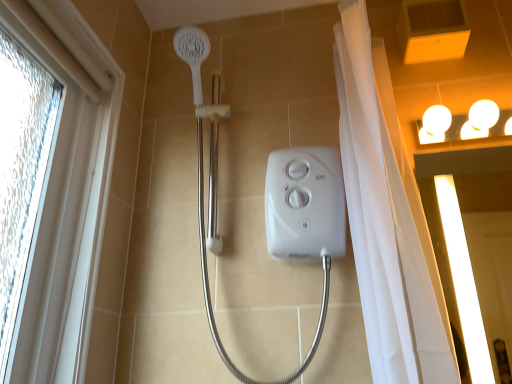
Question: From the image's perspective, is white glossy screen door at upper right over white textured window at left?

Choices:
 (A) yes
 (B) no

Answer: (B)

Question: Can you confirm if white glossy screen door at upper right is thinner than white textured window at left?

Choices:
 (A) yes
 (B) no

Answer: (A)

Question: From a real-world perspective, is white glossy screen door at upper right on white textured window at left?

Choices:
 (A) no
 (B) yes

Answer: (A)

Question: Does white glossy screen door at upper right touch white textured window at left?

Choices:
 (A) yes
 (B) no

Answer: (B)

Question: Does white glossy screen door at upper right come behind white textured window at left?

Choices:
 (A) yes
 (B) no

Answer: (A)

Question: Is white glossy screen door at upper right far from white textured window at left?

Choices:
 (A) no
 (B) yes

Answer: (B)

Question: Does white glossy light fixture at upper right appear on the right side of white textured window at left?

Choices:
 (A) no
 (B) yes

Answer: (B)

Question: Does white glossy light fixture at upper right lie in front of white textured window at left?

Choices:
 (A) no
 (B) yes

Answer: (A)

Question: Is white glossy light fixture at upper right further to the viewer compared to white textured window at left?

Choices:
 (A) yes
 (B) no

Answer: (A)

Question: Is white glossy light fixture at upper right not inside white textured window at left?

Choices:
 (A) yes
 (B) no

Answer: (A)

Question: Is white glossy light fixture at upper right not close to white textured window at left?

Choices:
 (A) no
 (B) yes

Answer: (B)

Question: Can you confirm if white glossy light fixture at upper right is shorter than white textured window at left?

Choices:
 (A) no
 (B) yes

Answer: (B)

Question: From a real-world perspective, is white textured window at left under white glossy screen door at upper right?

Choices:
 (A) no
 (B) yes

Answer: (A)